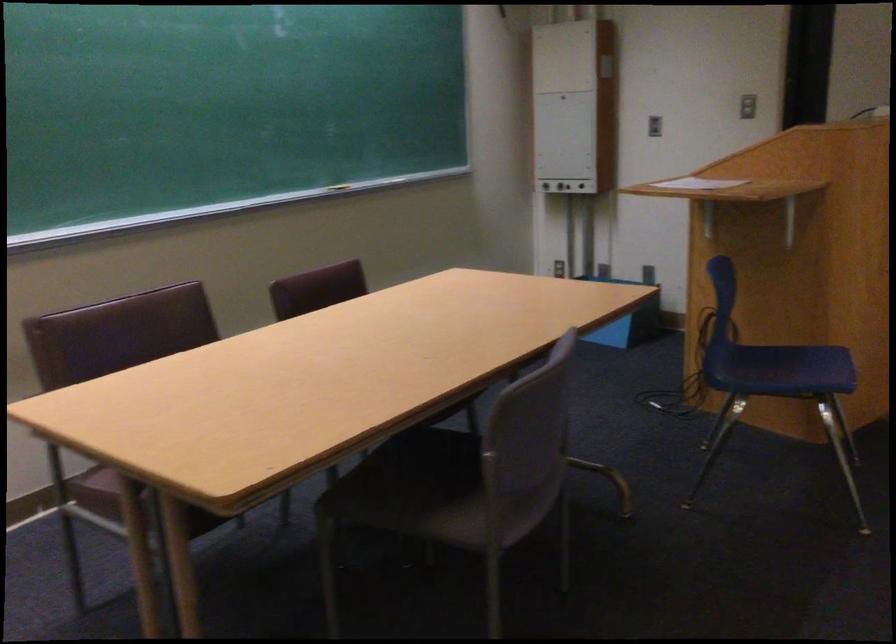
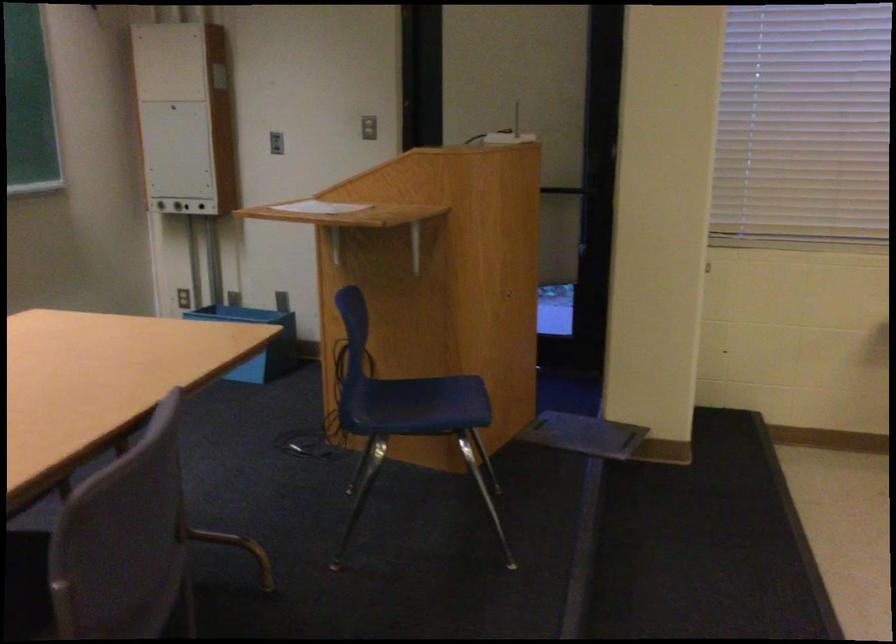
Question: The camera is either moving clockwise (left) or counter-clockwise (right) around the object. The first image is from the beginning of the video and the second image is from the end. Is the camera moving left or right when shooting the video?

Choices:
 (A) Left
 (B) Right

Answer: (A)